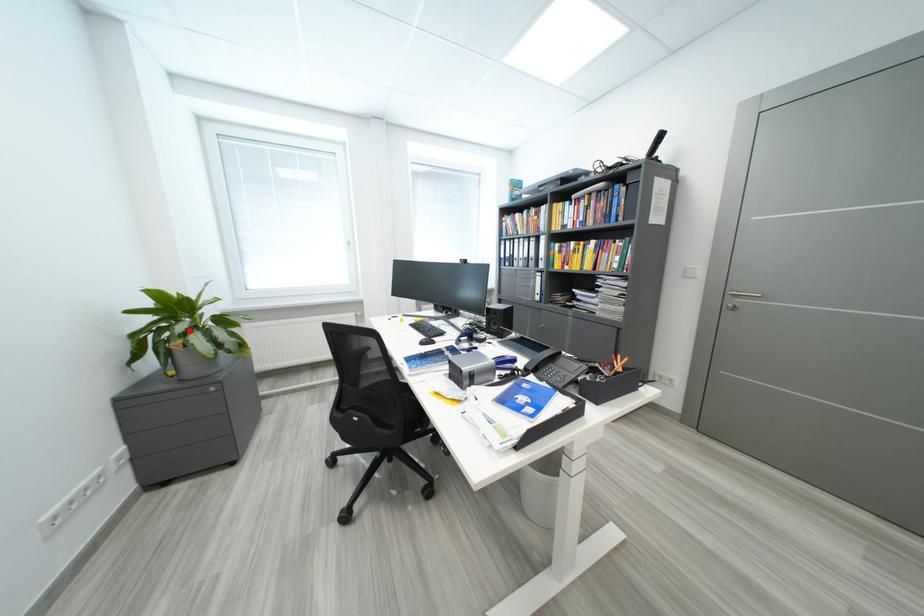
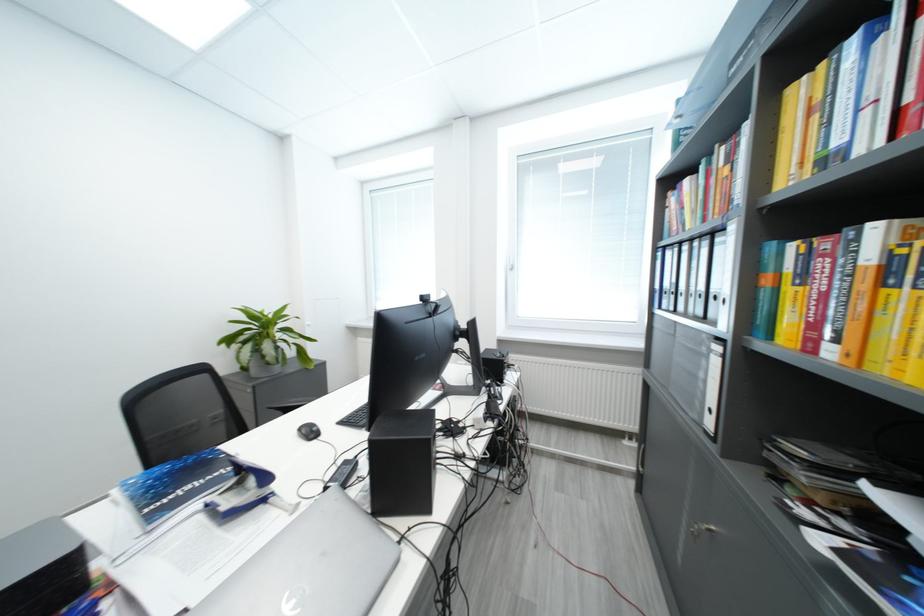
Find the pixel in the second image that matches the highlighted location in the first image.

(251, 341)